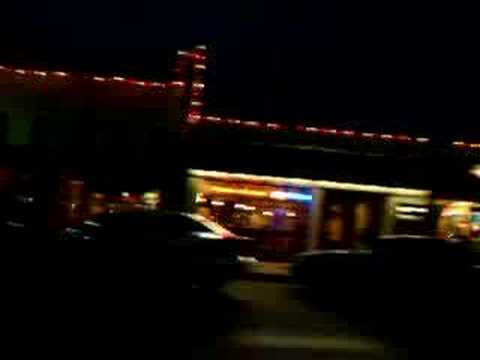
Where is `green light`? The height and width of the screenshot is (360, 480). green light is located at coordinates (474, 217).